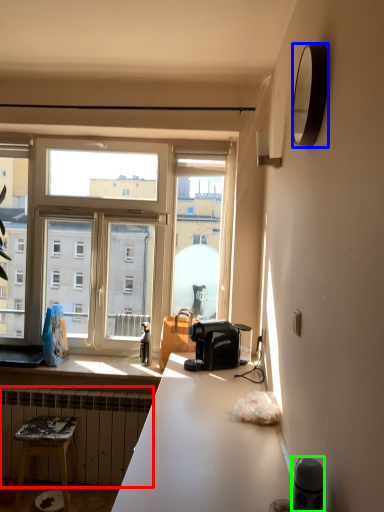
Question: Which is nearer to the radiator (highlighted by a red box)? mirror (highlighted by a blue box) or appliance (highlighted by a green box).

Choices:
 (A) mirror
 (B) appliance

Answer: (B)